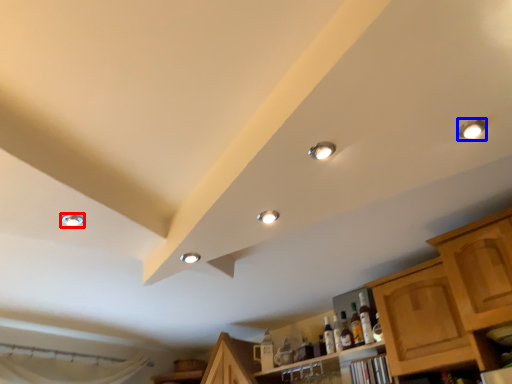
Question: Among these objects, which one is farthest to the camera, droplight (highlighted by a red box) or droplight (highlighted by a blue box)?

Choices:
 (A) droplight
 (B) droplight

Answer: (A)